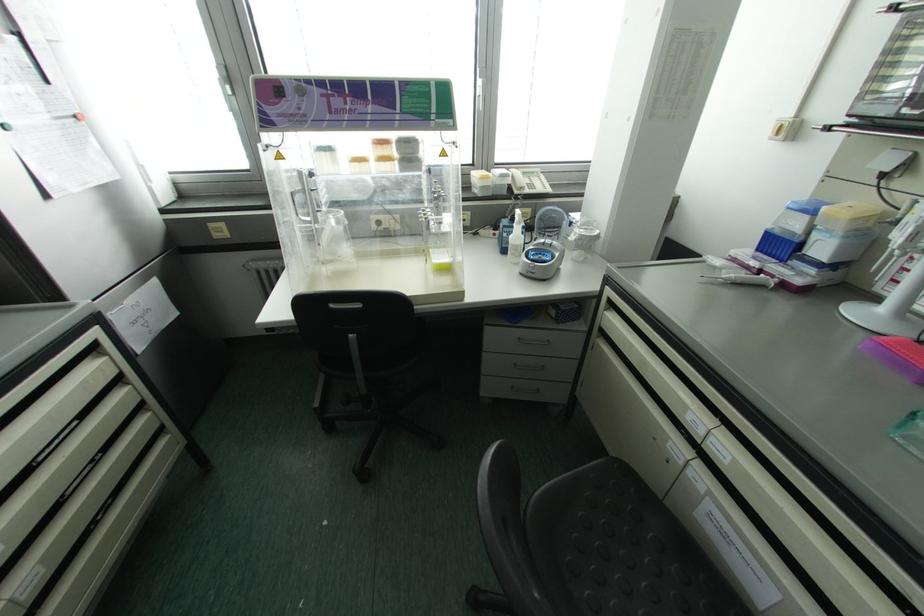
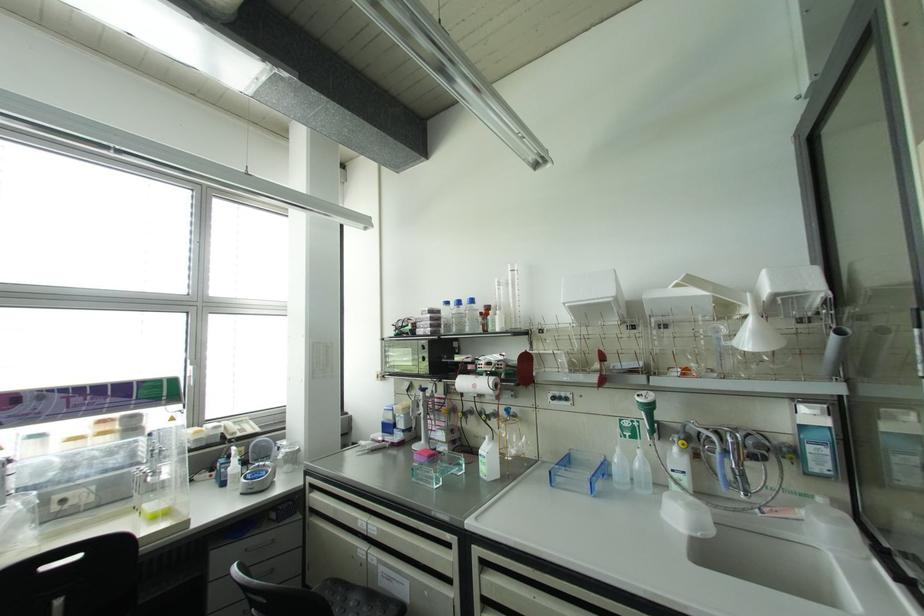
Find the pixel in the second image that matches pixel 642 361 in the first image.

(334, 509)